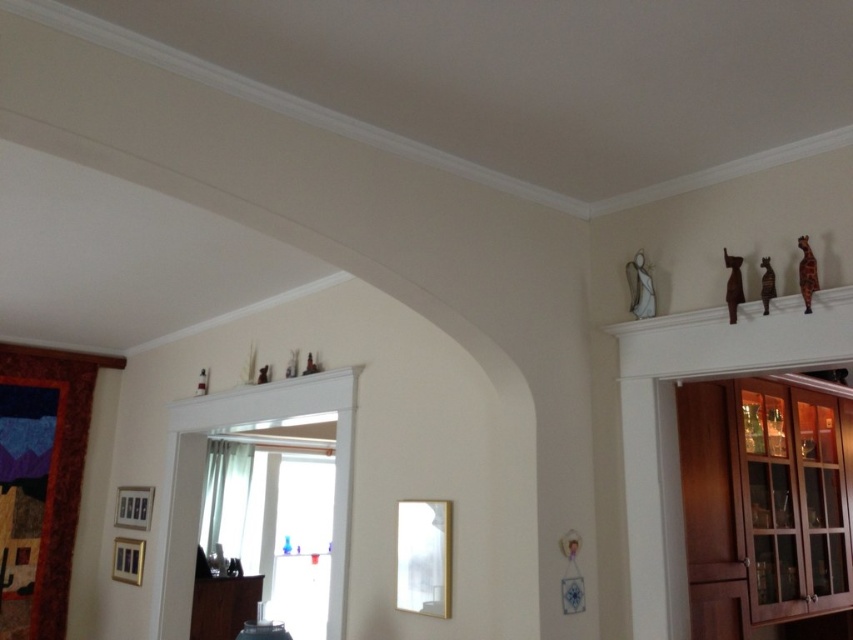
Question: Which point appears closest to the camera in this image?

Choices:
 (A) (239, 595)
 (B) (792, 600)

Answer: (B)

Question: Which point is closer to the camera?

Choices:
 (A) brown wooden cabinet at right
 (B) wooden cabinet at lower left

Answer: (A)

Question: Does brown wooden cabinet at right appear under wooden cabinet at lower left?

Choices:
 (A) yes
 (B) no

Answer: (B)

Question: Is brown wooden cabinet at right wider than wooden cabinet at lower left?

Choices:
 (A) yes
 (B) no

Answer: (A)

Question: Does brown wooden cabinet at right appear under wooden cabinet at lower left?

Choices:
 (A) no
 (B) yes

Answer: (A)